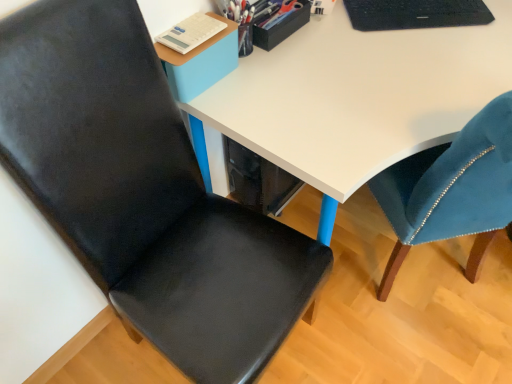
Measure the distance between point (197, 312) and camera.

The distance of point (197, 312) from camera is 3.37 feet.

Locate an element on the screen. The height and width of the screenshot is (384, 512). black textured laptop at upper right is located at coordinates (416, 14).

Can you see white glossy desk at center touching black textured laptop at upper right?

No, white glossy desk at center is not in contact with black textured laptop at upper right.

Which is closer to the camera, (289, 137) or (370, 11)?

Point (289, 137)

Which of these two, white glossy desk at center or black textured laptop at upper right, is wider?

Wider between the two is white glossy desk at center.

Is white glossy desk at center to the right of black textured laptop at upper right from the viewer's perspective?

Yes, white glossy desk at center is to the right of black textured laptop at upper right.

Who is bigger, metallic pen holder at upper center or white glossy desk at center?

Bigger between the two is white glossy desk at center.

Is metallic pen holder at upper center to the right of white glossy desk at center from the viewer's perspective?

No.

From the image's perspective, is metallic pen holder at upper center on white glossy desk at center?

Indeed, from the image's perspective, metallic pen holder at upper center is shown above white glossy desk at center.

The height and width of the screenshot is (384, 512). What are the coordinates of `desk on the right side of metallic pen holder at upper center` in the screenshot? It's located at (359, 95).

Which of these two, black textured laptop at upper right or white glossy desk at center, stands shorter?

black textured laptop at upper right is shorter.

From the image's perspective, is black textured laptop at upper right located above or below white glossy desk at center?

black textured laptop at upper right is above white glossy desk at center.

Considering the positions of objects black textured laptop at upper right and white glossy desk at center in the image provided, who is more to the right, black textured laptop at upper right or white glossy desk at center?

white glossy desk at center is more to the right.

Is black textured laptop at upper right positioned with its back to white glossy desk at center?

No, white glossy desk at center is not at the back of black textured laptop at upper right.

Which object is wider, white glossy desk at center or metallic pen holder at upper center?

white glossy desk at center is wider.

Considering the relative positions of white glossy desk at center and metallic pen holder at upper center in the image provided, is white glossy desk at center to the left of metallic pen holder at upper center from the viewer's perspective?

In fact, white glossy desk at center is to the right of metallic pen holder at upper center.

Considering their positions, is white glossy desk at center located in front of or behind metallic pen holder at upper center?

In the image, white glossy desk at center appears in front of metallic pen holder at upper center.

From the image's perspective, is white glossy desk at center above or below metallic pen holder at upper center?

white glossy desk at center is situated lower than metallic pen holder at upper center in the image.

From a real-world perspective, is matte black chair at left over white glossy desk at center?

Yes.

Does point (308, 299) appear closer or farther from the camera than point (496, 5)?

Point (308, 299).

Which of these two, matte black chair at left or white glossy desk at center, stands shorter?

With less height is white glossy desk at center.

Is matte black chair at left not near white glossy desk at center?

No, there isn't a large distance between matte black chair at left and white glossy desk at center.

Considering their positions, is white glossy desk at center located in front of or behind matte black chair at left?

white glossy desk at center is behind matte black chair at left.

Considering the sizes of objects white glossy desk at center and matte black chair at left in the image provided, who is taller, white glossy desk at center or matte black chair at left?

Standing taller between the two is matte black chair at left.

Does point (430, 61) come behind point (110, 249)?

Yes, it is.

Consider the image. Can you confirm if metallic pen holder at upper center is wider than black textured laptop at upper right?

No.

Who is more distant, metallic pen holder at upper center or black textured laptop at upper right?

black textured laptop at upper right is more distant.

From the image's perspective, does metallic pen holder at upper center appear higher than black textured laptop at upper right?

No, from the image's perspective, metallic pen holder at upper center is not on top of black textured laptop at upper right.

Does metallic pen holder at upper center turn towards black textured laptop at upper right?

No, metallic pen holder at upper center is not facing towards black textured laptop at upper right.

At what (x,y) coordinates should I click in order to perform the action: click on laptop that is above the white glossy desk at center (from the image's perspective). Please return your answer as a coordinate pair (x, y). The width and height of the screenshot is (512, 384). Looking at the image, I should click on (416, 14).

The height and width of the screenshot is (384, 512). Find the location of `desk that is below the metallic pen holder at upper center (from the image's perspective)`. desk that is below the metallic pen holder at upper center (from the image's perspective) is located at coordinates (359, 95).

In the scene shown: Looking at the image, which one is located closer to metallic pen holder at upper center, matte black chair at left or black textured laptop at upper right?

black textured laptop at upper right is positioned closer to the anchor metallic pen holder at upper center.

Which object lies further to the anchor point metallic pen holder at upper center, black textured laptop at upper right or white glossy desk at center?

black textured laptop at upper right is further to metallic pen holder at upper center.

Estimate the real-world distances between objects in this image. Which object is further from metallic pen holder at upper center, black textured laptop at upper right or matte black chair at left?

matte black chair at left lies further to metallic pen holder at upper center than the other object.

Considering their positions, is metallic pen holder at upper center positioned closer to white glossy desk at center than matte black chair at left?

metallic pen holder at upper center.

Estimate the real-world distances between objects in this image. Which object is closer to metallic pen holder at upper center, white glossy desk at center or matte black chair at left?

Based on the image, white glossy desk at center appears to be nearer to metallic pen holder at upper center.

From the image, which object appears to be nearer to white glossy desk at center, black textured laptop at upper right or metallic pen holder at upper center?

Based on the image, black textured laptop at upper right appears to be nearer to white glossy desk at center.

Which object lies nearer to the anchor point matte black chair at left, white glossy desk at center or metallic pen holder at upper center?

white glossy desk at center is positioned closer to the anchor matte black chair at left.

Looking at the image, which one is located further to metallic pen holder at upper center, matte black chair at left or white glossy desk at center?

matte black chair at left is positioned further to the anchor metallic pen holder at upper center.

Identify the location of stationery between white glossy desk at center and black textured laptop at upper right in the front-back direction. The width and height of the screenshot is (512, 384). (282, 28).

Locate an element on the screen. The image size is (512, 384). stationery located between matte black chair at left and black textured laptop at upper right in the depth direction is located at coordinates (282, 28).

This screenshot has width=512, height=384. I want to click on desk between matte black chair at left and black textured laptop at upper right from front to back, so click(359, 95).

Find the location of `desk located between matte black chair at left and metallic pen holder at upper center in the depth direction`. desk located between matte black chair at left and metallic pen holder at upper center in the depth direction is located at coordinates (359, 95).